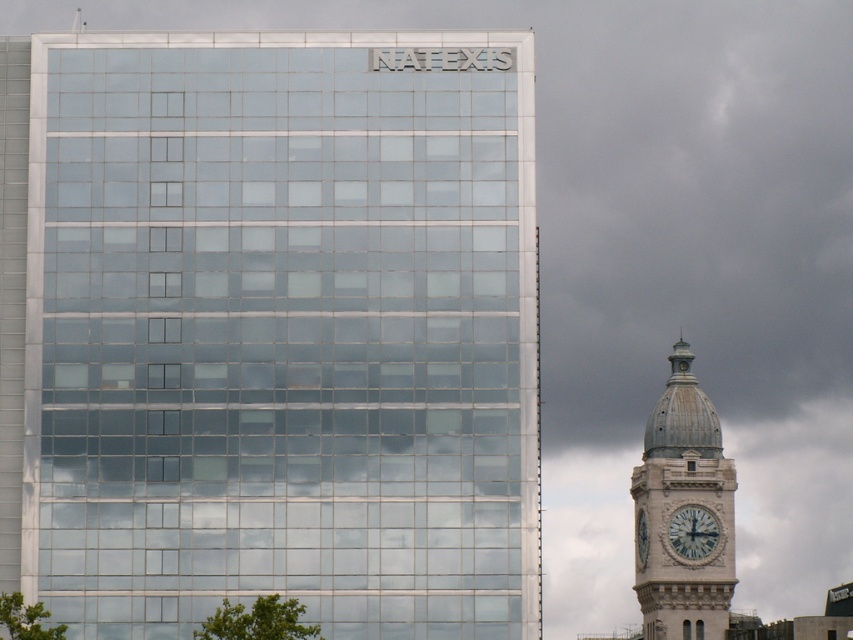
Question: Can you confirm if transparent glass building at upper left is thinner than white stone clock at right?

Choices:
 (A) no
 (B) yes

Answer: (A)

Question: Which point appears closest to the camera in this image?

Choices:
 (A) (641, 515)
 (B) (698, 557)
 (C) (514, 150)

Answer: (C)

Question: From the image, what is the correct spatial relationship of transparent glass building at upper left in relation to white stone clock at right?

Choices:
 (A) below
 (B) above

Answer: (B)

Question: Based on their relative distances, which object is farther from the light gray stone clock tower at right?

Choices:
 (A) white stone clock at right
 (B) transparent glass building at upper left

Answer: (B)

Question: Which point appears farthest from the camera in this image?

Choices:
 (A) (689, 508)
 (B) (720, 580)

Answer: (A)

Question: Can you confirm if transparent glass building at upper left is smaller than light gray stone clock tower at right?

Choices:
 (A) no
 (B) yes

Answer: (B)